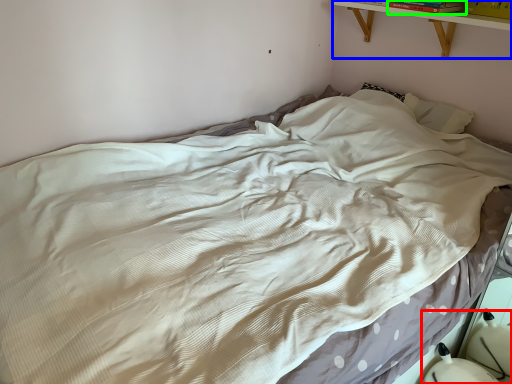
Question: Based on their relative distances, which object is farther from swivel chair (highlighted by a red box)? Choose from shelf (highlighted by a blue box) and book (highlighted by a green box).

Choices:
 (A) shelf
 (B) book

Answer: (B)